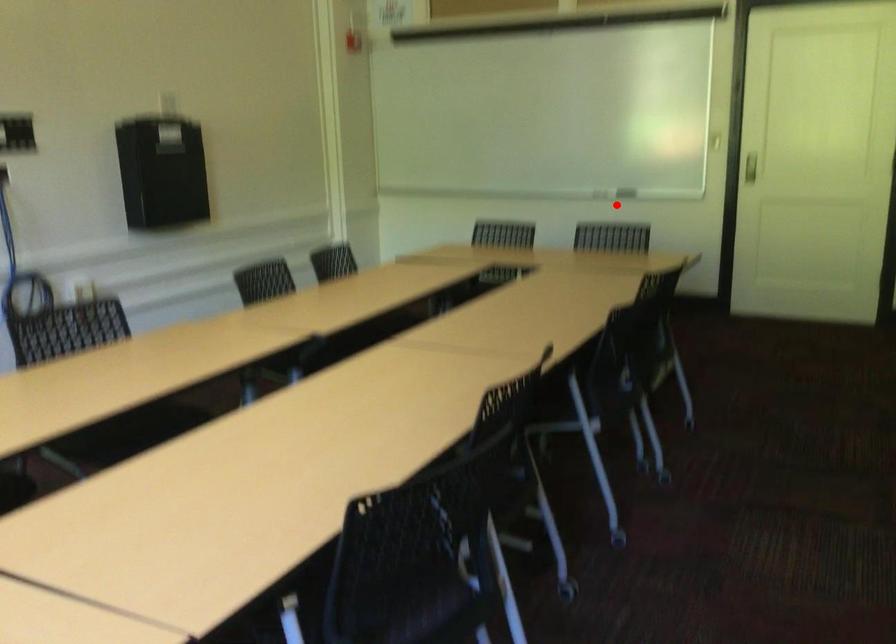
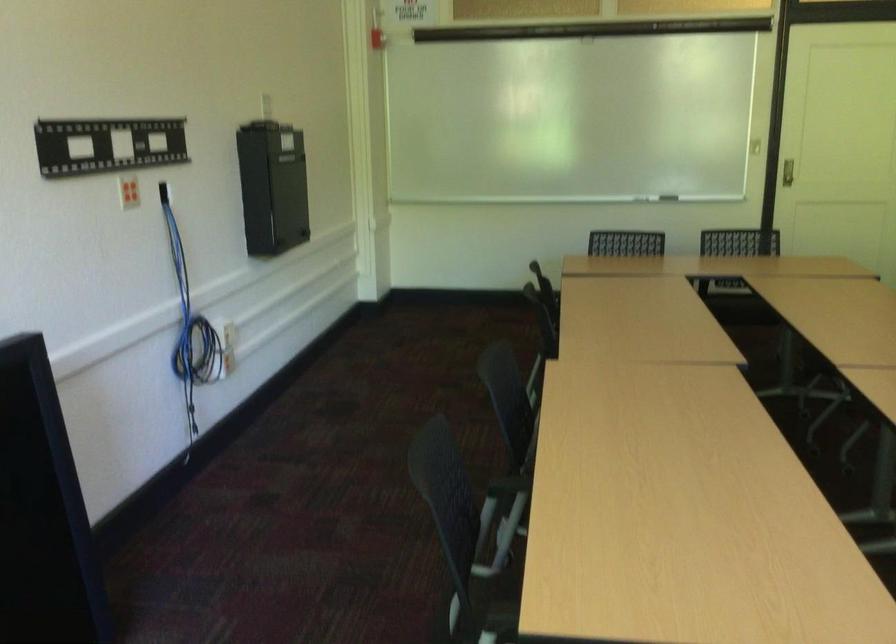
The point at the highlighted location is marked in the first image. Where is the corresponding point in the second image?

(668, 198)